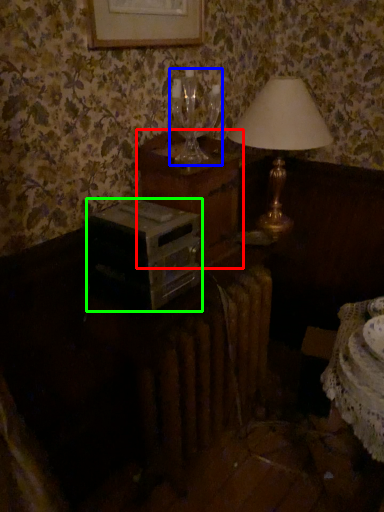
Question: Considering the real-world distances, which object is closest to nightstand (highlighted by a red box)? wine glass (highlighted by a blue box) or stereo (highlighted by a green box).

Choices:
 (A) wine glass
 (B) stereo

Answer: (A)